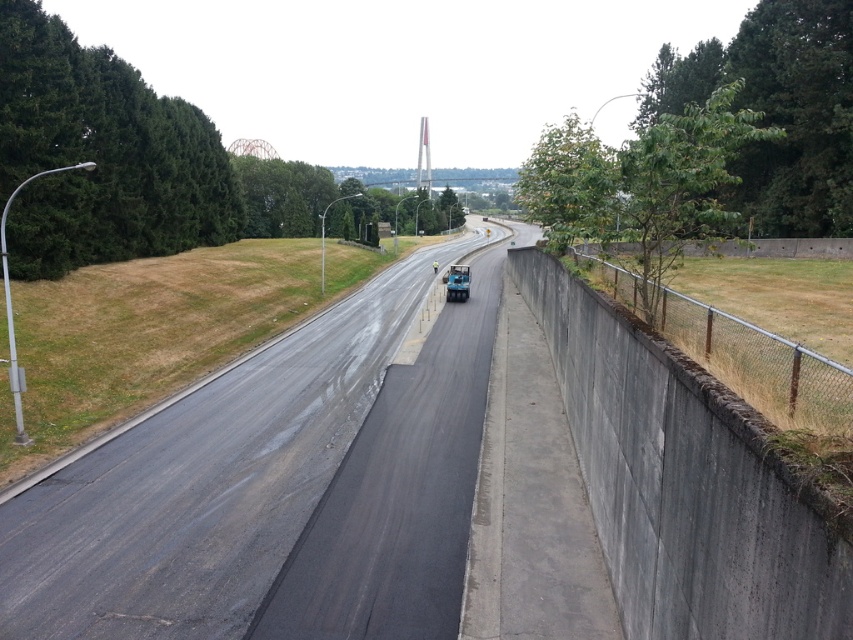
Can you confirm if black asphalt road at center is wider than metallic blue truck at center?

Correct, the width of black asphalt road at center exceeds that of metallic blue truck at center.

Which is in front, point (306, 422) or point (447, 269)?

Positioned in front is point (306, 422).

Find the location of `black asphalt road at center`. black asphalt road at center is located at coordinates (206, 484).